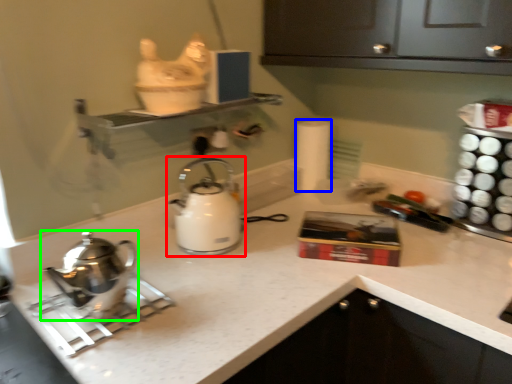
Question: Which is farther away from kettle (highlighted by a red box)? toilet paper (highlighted by a blue box) or kettle (highlighted by a green box)?

Choices:
 (A) toilet paper
 (B) kettle

Answer: (A)